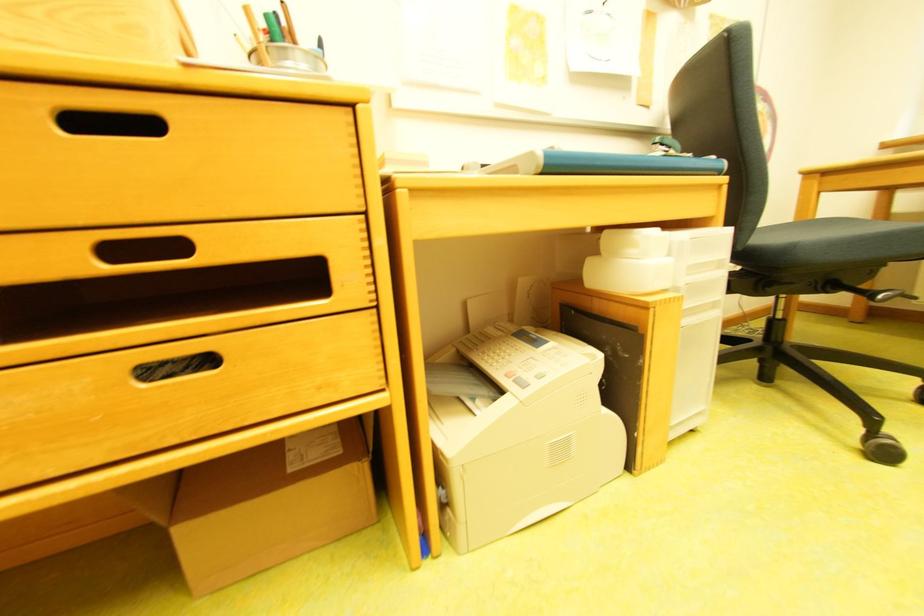
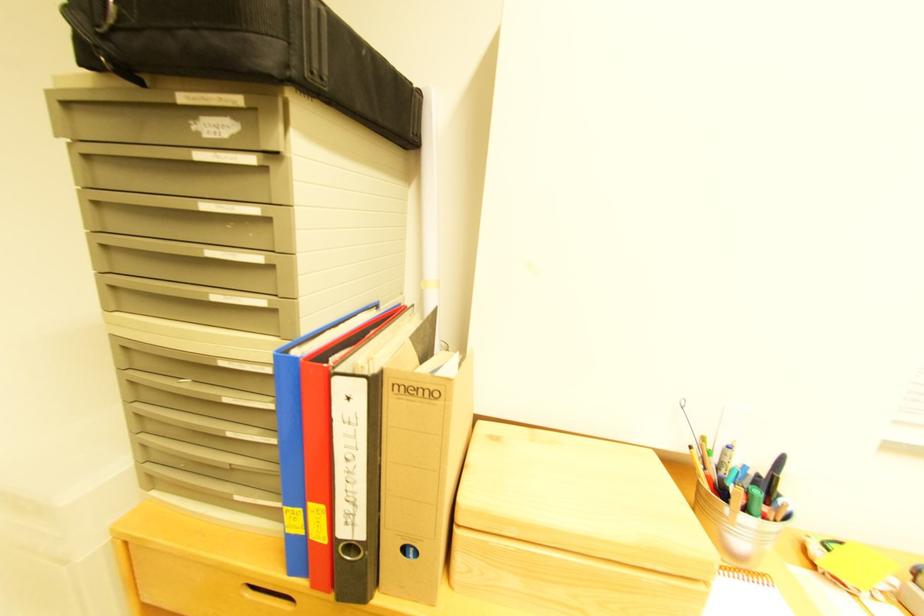
Question: The images are taken continuously from a first-person perspective. In which direction is your viewpoint rotating?

Choices:
 (A) Left
 (B) Right
 (C) Up
 (D) Down

Answer: (A)